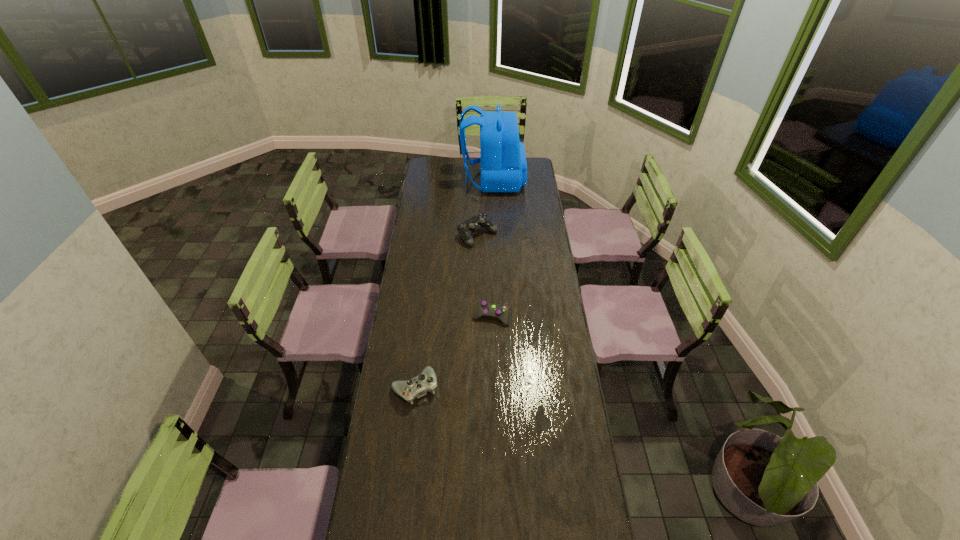
This screenshot has height=540, width=960. Identify the location of backpack. (x=503, y=161).

Find the location of a particular element. Image resolution: width=960 pixels, height=540 pixels. the tallest object is located at coordinates (503, 161).

Where is `the farthest control`? The image size is (960, 540). the farthest control is located at coordinates pos(466,228).

Find the location of `the second tallest object`. the second tallest object is located at coordinates (466, 228).

This screenshot has height=540, width=960. In order to click on the second tallest control in this screenshot , I will do `click(418, 386)`.

Find the location of `the leftmost object`. the leftmost object is located at coordinates (418, 386).

The height and width of the screenshot is (540, 960). I want to click on the second farthest control, so click(x=483, y=308).

The image size is (960, 540). Find the location of `the shortest control`. the shortest control is located at coordinates [483, 308].

Locate an element on the screen. vacant space located 0.090m on the back of the backpack is located at coordinates (446, 180).

Find the location of `vacant space situated 0.160m on the back of the backpack`. vacant space situated 0.160m on the back of the backpack is located at coordinates (435, 180).